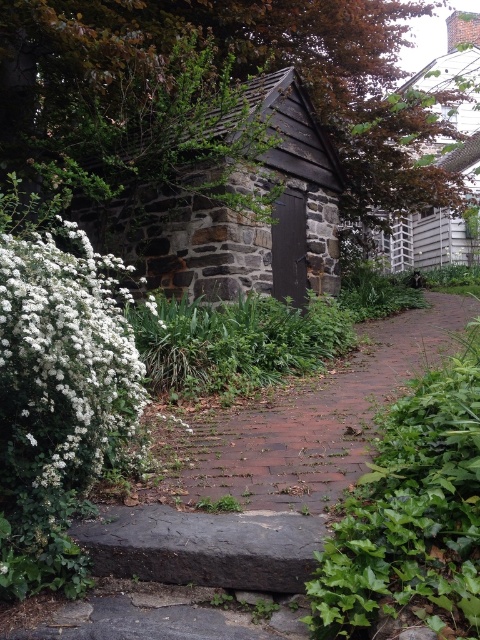
Between point (176, 230) and point (86, 257), which one is positioned in front?

Point (86, 257)

Which is behind, point (166, 244) or point (46, 476)?

Point (166, 244)

The width and height of the screenshot is (480, 640). I want to click on dark brown stone log cabin at center, so click(x=238, y=211).

Does dark brown stone log cabin at center have a greater width compared to brick at center?

Correct, the width of dark brown stone log cabin at center exceeds that of brick at center.

Which is more to the left, dark brown stone log cabin at center or brick at center?

From the viewer's perspective, dark brown stone log cabin at center appears more on the left side.

Who is more distant from viewer, (x=228, y=116) or (x=285, y=442)?

The point (x=228, y=116) is more distant.

The image size is (480, 640). Identify the location of dark brown stone log cabin at center. click(x=238, y=211).

Which is in front, point (109, 346) or point (262, 424)?

Point (109, 346)

Who is positioned more to the right, white fluffy bush at left or brick at center?

A: brick at center is more to the right.

Does point (67, 340) come closer to viewer compared to point (404, 339)?

Yes.

You are a GUI agent. You are given a task and a screenshot of the screen. Output one action in this format:
    pyautogui.click(x=<x>, y=<y>)
    Task: Click on the white fluffy bush at left
    The image size is (480, 640).
    Given the screenshot: What is the action you would take?
    pyautogui.click(x=64, y=364)